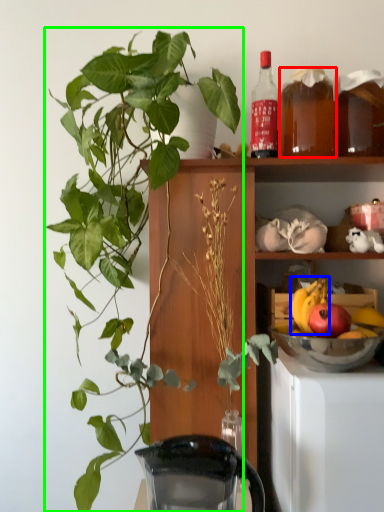
Question: Considering the real-world distances, which object is farthest from beverage (highlighted by a red box)? fruit (highlighted by a blue box) or houseplant (highlighted by a green box)?

Choices:
 (A) fruit
 (B) houseplant

Answer: (B)